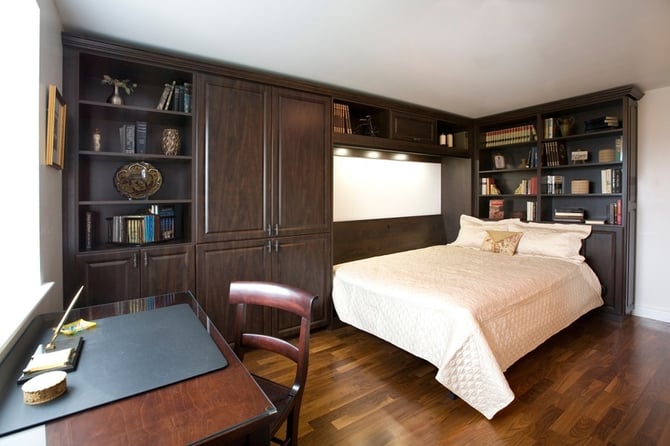
This screenshot has width=670, height=446. Identify the location of foot of bed. (398, 290).